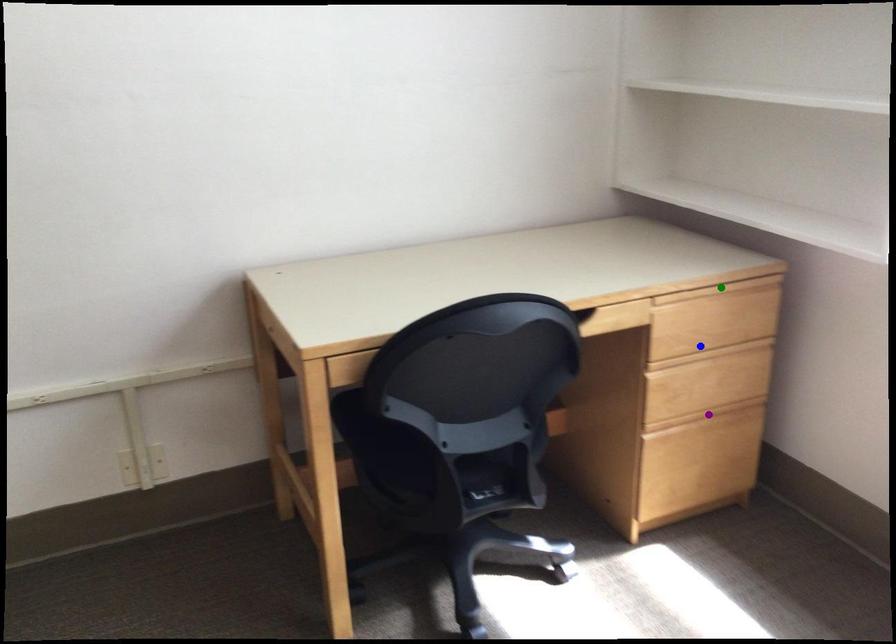
Order these from farthest to nearest:
green point, purple point, blue point

purple point → blue point → green point